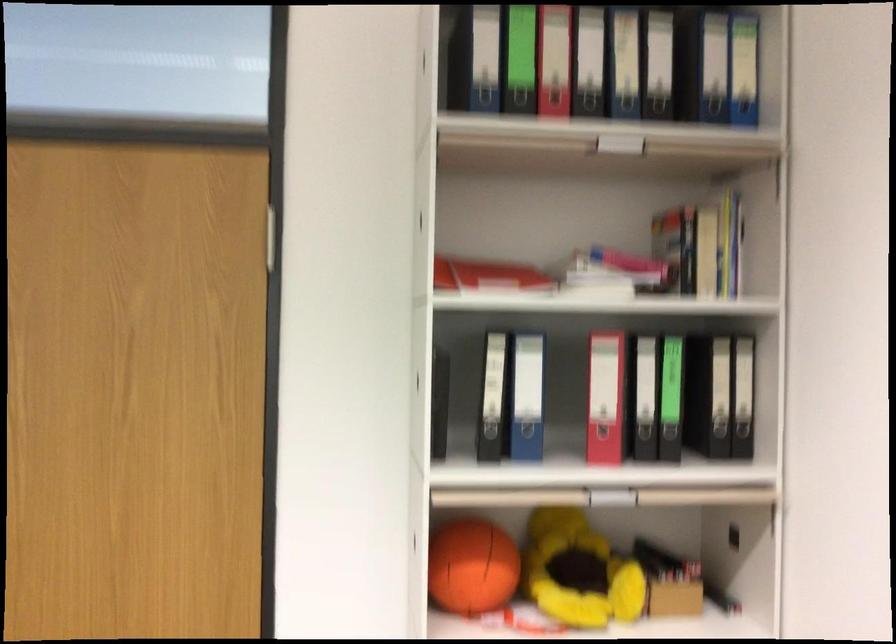
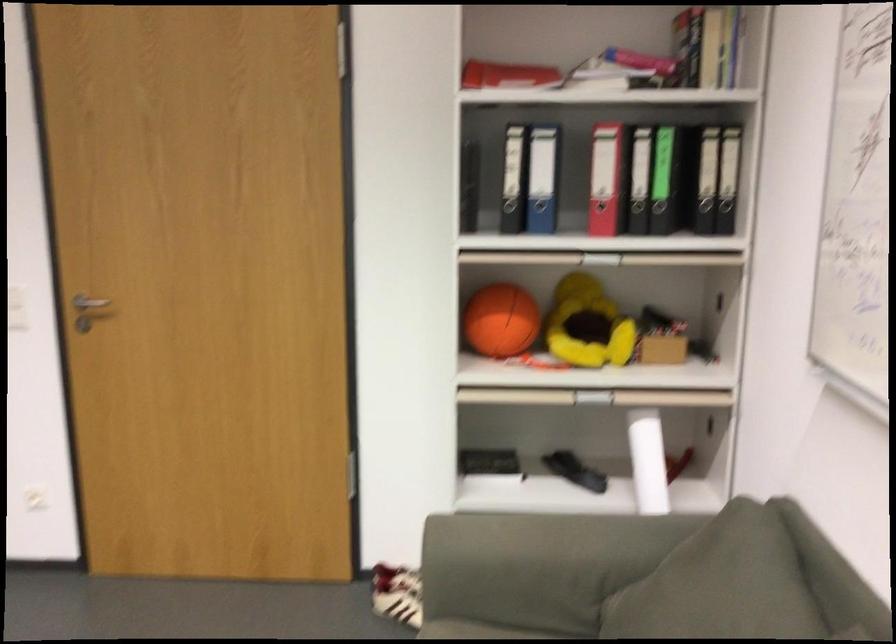
Find the pixel in the second image that matches (480,576) in the first image.

(501, 321)